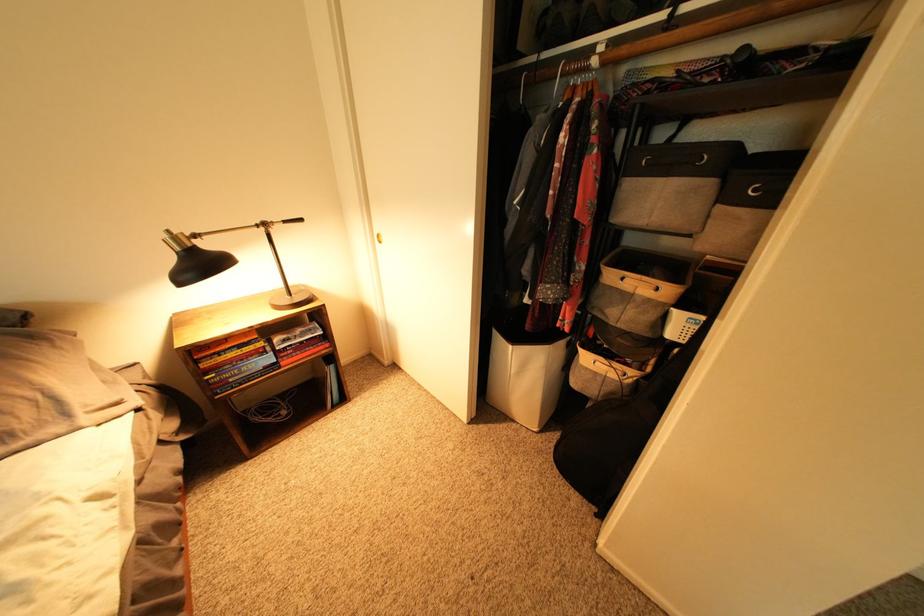
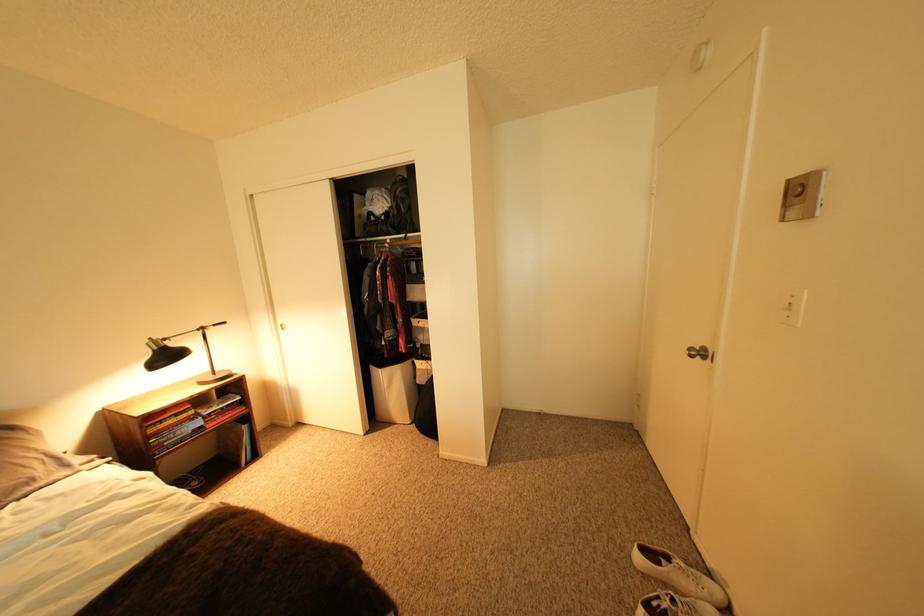
Where in the second image is the point corresponding to pixel 252 371 from the first image?

(188, 435)